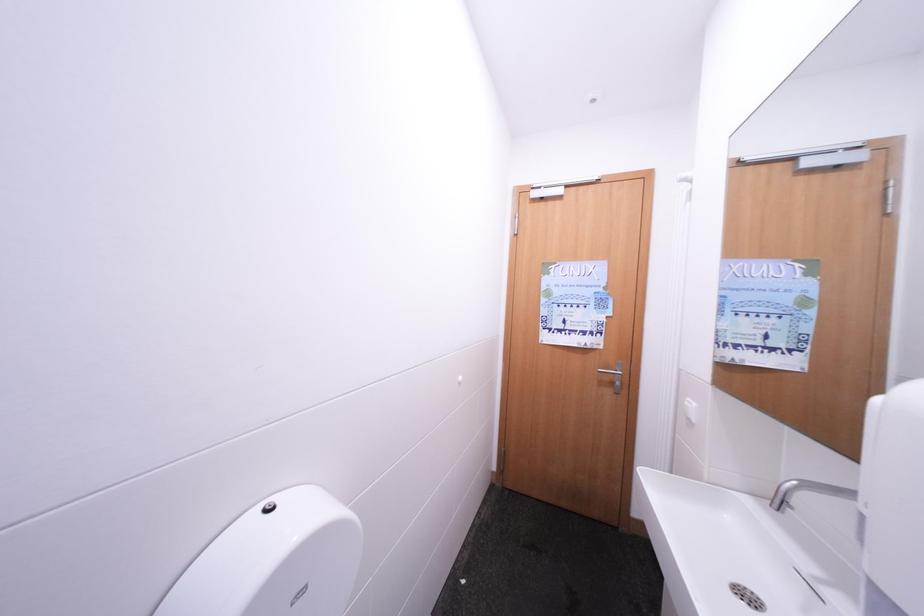
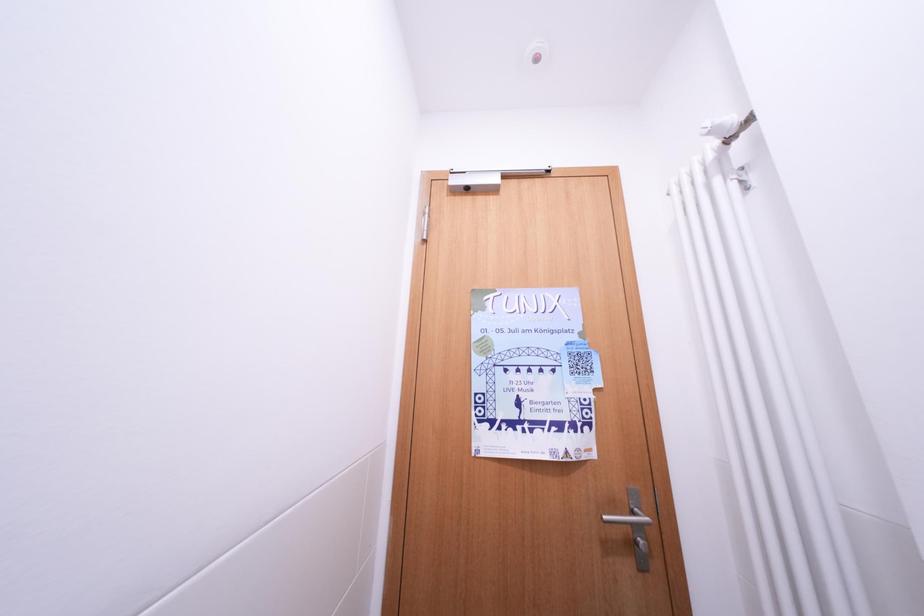
Question: The images are taken continuously from a first-person perspective. In which direction are you moving?

Choices:
 (A) Left
 (B) Right
 (C) Forward
 (D) Backward

Answer: (C)